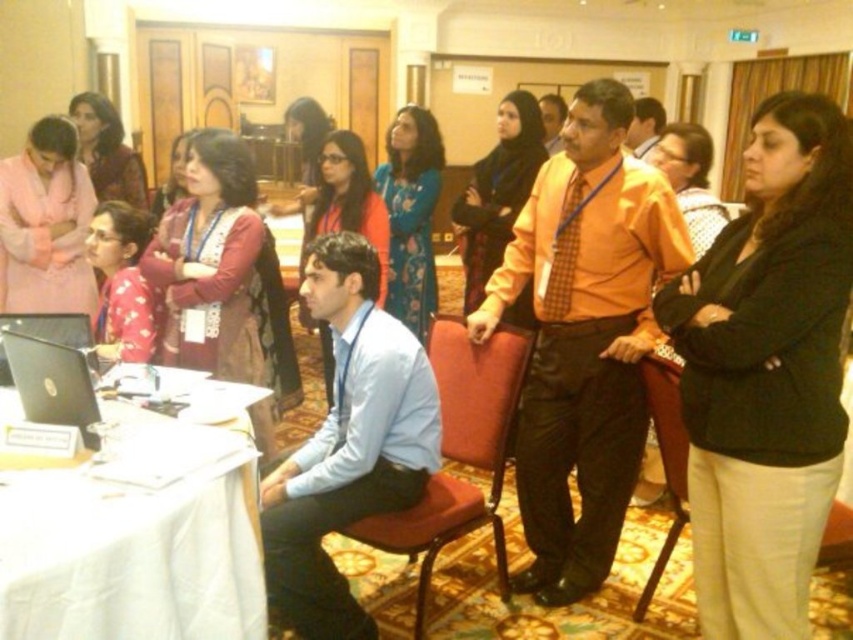
Question: Can you confirm if orange shirt at center is thinner than orange smooth shirt at center?

Choices:
 (A) no
 (B) yes

Answer: (A)

Question: Is light beige fabric chair at lower right wider than matte orange shirt at center?

Choices:
 (A) yes
 (B) no

Answer: (B)

Question: Which is nearer to the black glossy laptop at lower left?

Choices:
 (A) red fabric chair at center
 (B) matte orange shirt at center
 (C) light beige fabric chair at lower right

Answer: (A)

Question: Can you confirm if light beige fabric chair at lower right is positioned below matte orange shirt at center?

Choices:
 (A) no
 (B) yes

Answer: (B)

Question: Among these objects, which one is farthest from the camera?

Choices:
 (A) light blue shirt at center
 (B) white cloth-covered table at lower left

Answer: (A)

Question: Which point is farther from the camera taking this photo?

Choices:
 (A) (553, 125)
 (B) (837, 422)
 (C) (164, 596)

Answer: (A)